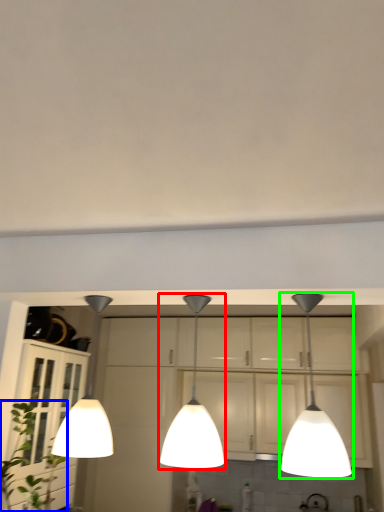
Question: Considering the real-world distances, which object is closest to lamp (highlighted by a red box)? plant (highlighted by a blue box) or lamp (highlighted by a green box).

Choices:
 (A) plant
 (B) lamp

Answer: (B)